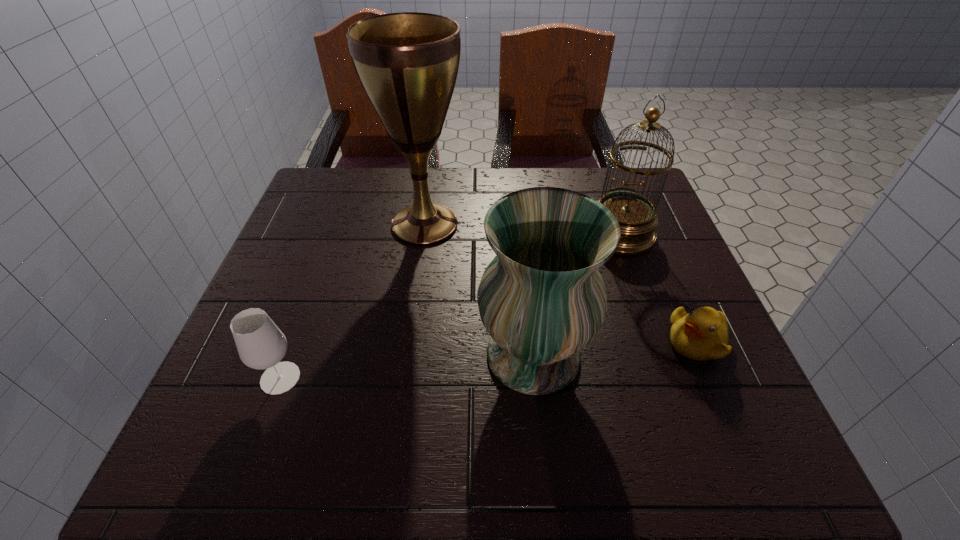
Locate an element on the screen. vacant space at the far edge is located at coordinates (488, 189).

This screenshot has height=540, width=960. I want to click on free space at the near edge of the desktop, so pos(416,461).

Identify the location of vacant space at the left edge. (x=307, y=245).

The image size is (960, 540). In the image, there is a desktop. In order to click on vacant space at the right edge in this screenshot , I will do `click(655, 344)`.

The width and height of the screenshot is (960, 540). In order to click on blank space at the far left corner of the desktop in this screenshot , I will do `click(327, 188)`.

Locate an element on the screen. vacant space at the near left corner is located at coordinates (237, 451).

This screenshot has height=540, width=960. Find the location of `vacant space at the far right corner of the desktop`. vacant space at the far right corner of the desktop is located at coordinates pos(628,186).

Image resolution: width=960 pixels, height=540 pixels. What are the coordinates of `vacant point located between the vase and the leftmost object` in the screenshot? It's located at (407, 367).

At what (x,y) coordinates should I click in order to perform the action: click on vacant space that's between the tallest object and the second shortest object. Please return your answer as a coordinate pair (x, y). Looking at the image, I should click on (352, 301).

Find the location of a particular element. This screenshot has width=960, height=540. free point between the trophy cup and the glass is located at coordinates (352, 301).